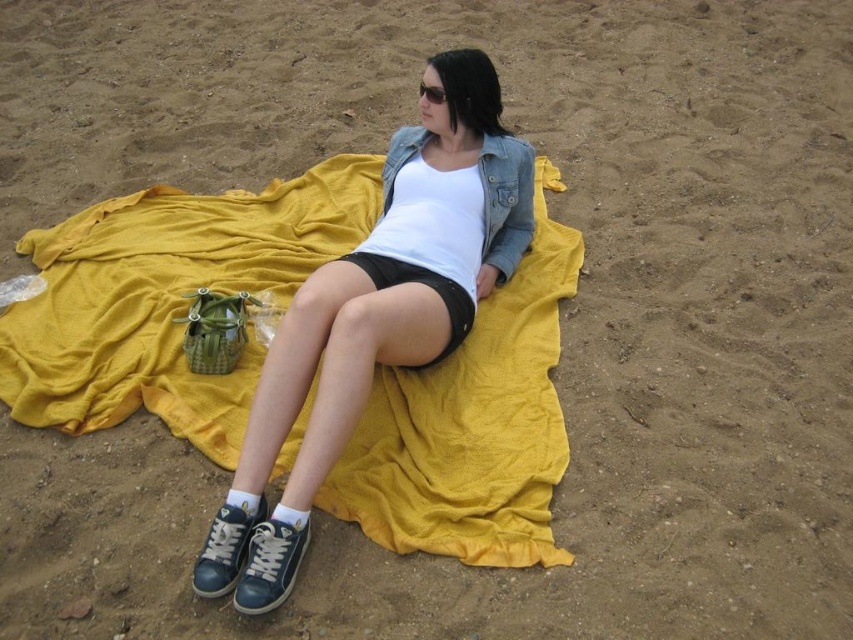
Does matte black shorts at center have a larger size compared to dark blue leather shoe at lower center?

Correct, matte black shorts at center is larger in size than dark blue leather shoe at lower center.

From the picture: Between matte black shorts at center and dark blue leather shoe at lower center, which one is positioned higher?

matte black shorts at center

Which is in front, point (532, 188) or point (254, 516)?

Point (254, 516)

The width and height of the screenshot is (853, 640). I want to click on matte black shorts at center, so click(396, 275).

Who is more distant from viewer, (x=432, y=188) or (x=270, y=579)?

Point (x=432, y=188)

Is matte black shorts at center taller than dark blue canvas sneaker at lower center?

Indeed, matte black shorts at center has a greater height compared to dark blue canvas sneaker at lower center.

Image resolution: width=853 pixels, height=640 pixels. What do you see at coordinates (396, 275) in the screenshot?
I see `matte black shorts at center` at bounding box center [396, 275].

Identify the location of matte black shorts at center. (396, 275).

Which is above, dark blue canvas sneaker at lower center or black matte shorts at center?

Positioned higher is black matte shorts at center.

Who is positioned more to the right, dark blue canvas sneaker at lower center or black matte shorts at center?

black matte shorts at center is more to the right.

Is point (254, 548) farther from viewer compared to point (369, 260)?

No, it is not.

Identify the location of dark blue canvas sneaker at lower center. (x=270, y=563).